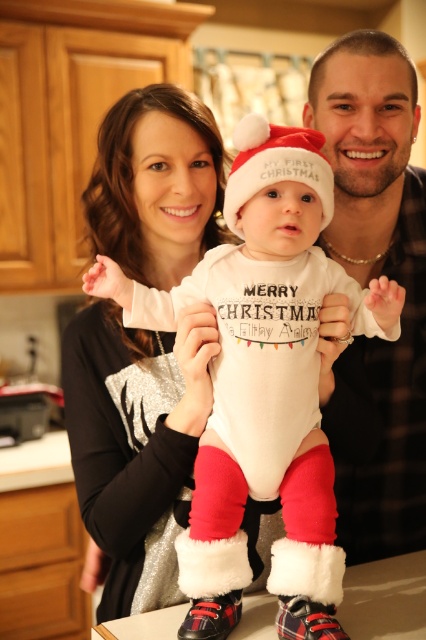
Question: Estimate the real-world distances between objects in this image. Which object is closer to the white cotton onesie at center?

Choices:
 (A) matte silver sweater at center
 (B) matte black shirt at center

Answer: (A)

Question: Observing the image, what is the correct spatial positioning of matte silver sweater at center in reference to white cotton onesie at center?

Choices:
 (A) below
 (B) above

Answer: (B)

Question: Which point is farther to the camera?

Choices:
 (A) matte black shirt at center
 (B) matte silver sweater at center

Answer: (A)

Question: Which is nearer to the matte silver sweater at center?

Choices:
 (A) white cotton onesie at center
 (B) matte black shirt at center

Answer: (A)

Question: Does white cotton onesie at center appear on the right side of matte black shirt at center?

Choices:
 (A) yes
 (B) no

Answer: (B)

Question: Can you confirm if white cotton onesie at center is positioned above matte black shirt at center?

Choices:
 (A) no
 (B) yes

Answer: (A)